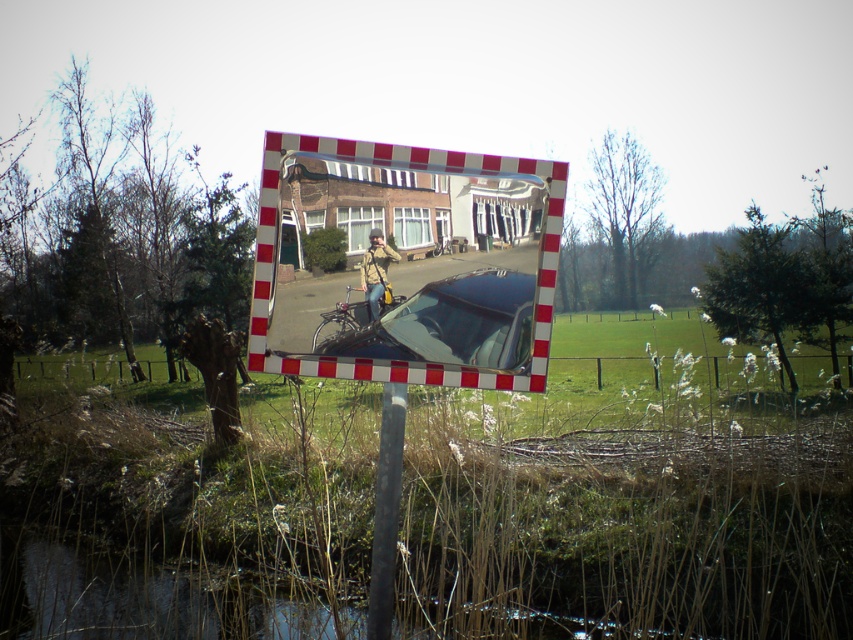
Question: Does reflective glass mirror at center appear under matte black car at center?

Choices:
 (A) no
 (B) yes

Answer: (A)

Question: Is reflective glass mirror at center thinner than matte black car at center?

Choices:
 (A) yes
 (B) no

Answer: (B)

Question: Which point is closer to the camera?

Choices:
 (A) reflective glass mirror at center
 (B) matte black car at center

Answer: (A)

Question: Is reflective glass mirror at center to the right of matte black car at center from the viewer's perspective?

Choices:
 (A) yes
 (B) no

Answer: (B)